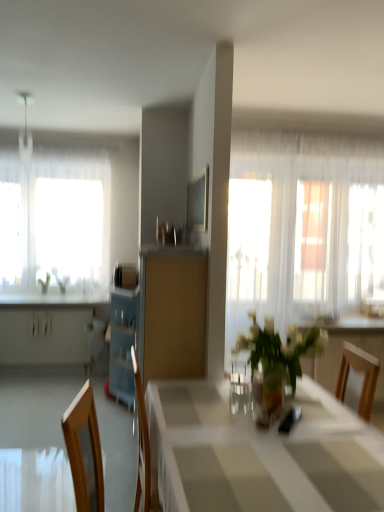
Question: From a real-world perspective, does white glossy table at center stand above white glossy countertop at left?

Choices:
 (A) no
 (B) yes

Answer: (A)

Question: Would you say white glossy table at center contains white glossy countertop at left?

Choices:
 (A) no
 (B) yes

Answer: (A)

Question: Is white glossy table at center positioned in front of white glossy countertop at left?

Choices:
 (A) yes
 (B) no

Answer: (A)

Question: Does white glossy table at center have a lesser width compared to white glossy countertop at left?

Choices:
 (A) no
 (B) yes

Answer: (A)

Question: Is white glossy table at center bigger than white glossy countertop at left?

Choices:
 (A) no
 (B) yes

Answer: (B)

Question: Is point (3, 188) closer or farther from the camera than point (200, 272)?

Choices:
 (A) closer
 (B) farther

Answer: (B)

Question: Looking at their shapes, would you say translucent glass window at left is wider or thinner than matte wood cabinet at center?

Choices:
 (A) wide
 (B) thin

Answer: (B)

Question: From the image's perspective, is translucent glass window at left located above or below matte wood cabinet at center?

Choices:
 (A) below
 (B) above

Answer: (B)

Question: In the image, is translucent glass window at left positioned in front of or behind matte wood cabinet at center?

Choices:
 (A) front
 (B) behind

Answer: (B)

Question: Is translucent glass vase at center wider or thinner than wooden chair at right?

Choices:
 (A) wide
 (B) thin

Answer: (A)

Question: From the image's perspective, is translucent glass vase at center positioned above or below wooden chair at right?

Choices:
 (A) below
 (B) above

Answer: (B)

Question: Is translucent glass vase at center in front of or behind wooden chair at right in the image?

Choices:
 (A) behind
 (B) front

Answer: (B)

Question: Is translucent glass vase at center taller or shorter than wooden chair at right?

Choices:
 (A) tall
 (B) short

Answer: (B)

Question: Is white glossy table at center taller or shorter than translucent glass window at left?

Choices:
 (A) short
 (B) tall

Answer: (A)

Question: Relative to translucent glass window at left, is white glossy table at center in front or behind?

Choices:
 (A) behind
 (B) front

Answer: (B)